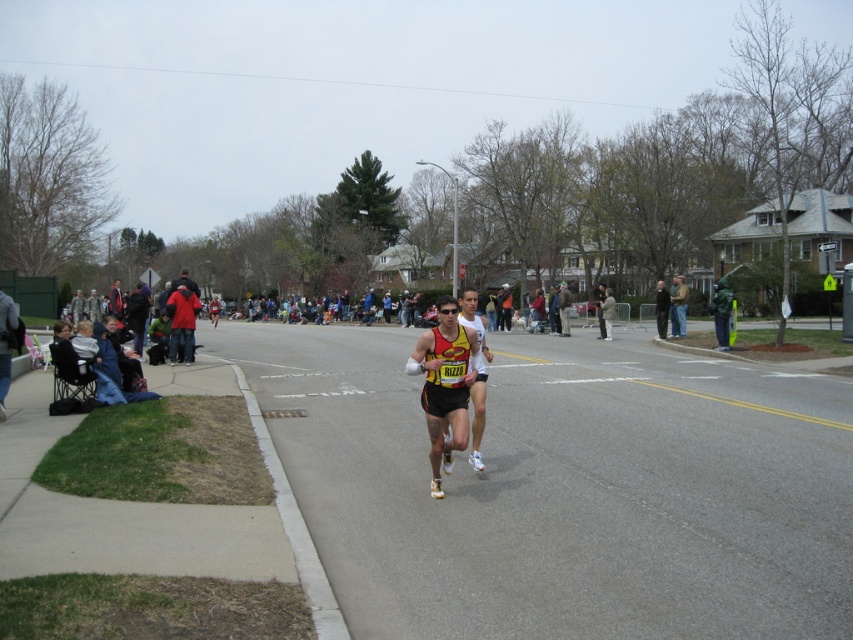
From the picture: You are a photographer at the marathon event. You want to capture a photo of both the black running suit at center and the yellow jersey at center. Which runner will appear smaller in the photo?

The black running suit at center will appear smaller in the photo because it occupies less space than the yellow jersey at center.

You are a photographer positioned at the finish line of the marathon. You want to capture a photo of both the black running suit at center and the yellow jersey at center in a single frame. Which runner should you focus on first to ensure both are in the shot?

You should focus on the yellow jersey at center first because the black running suit at center is wider and might block the view of the yellow jersey at center if not positioned correctly.